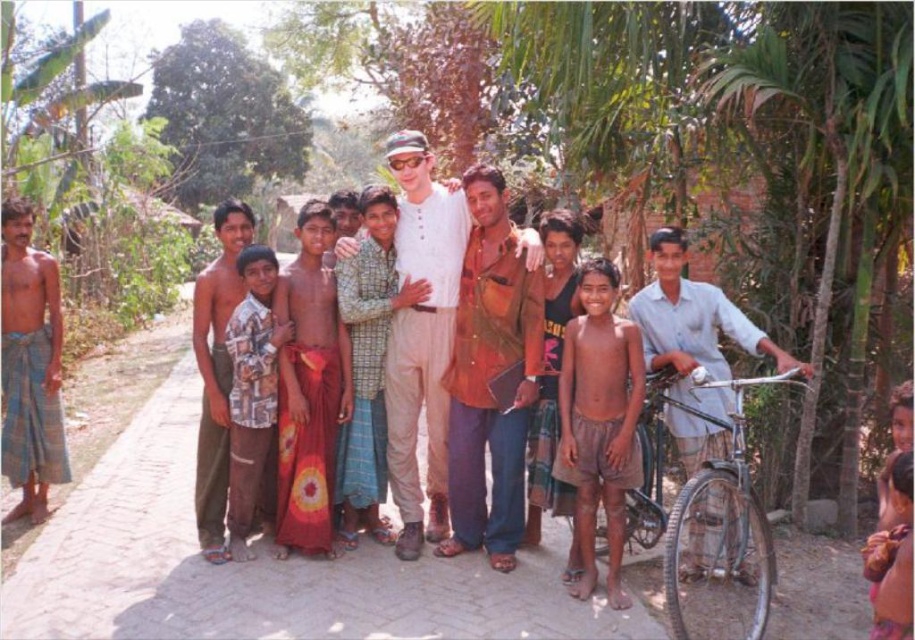
Between brown leather jacket at center and silver metallic bicycle at right, which one appears on the right side from the viewer's perspective?

Positioned to the right is silver metallic bicycle at right.

Does brown leather jacket at center have a lesser width compared to silver metallic bicycle at right?

Correct, brown leather jacket at center's width is less than silver metallic bicycle at right's.

Does point (466, 492) come farther from viewer compared to point (659, 388)?

Yes.

At what (x,y) coordinates should I click in order to perform the action: click on brown leather jacket at center. Please return your answer as a coordinate pair (x, y). Looking at the image, I should click on (490, 376).

Between brown leather jacket at center and brown cotton shorts at center, which one is positioned higher?

brown leather jacket at center

Can you confirm if brown leather jacket at center is positioned to the right of brown cotton shorts at center?

No, brown leather jacket at center is not to the right of brown cotton shorts at center.

Is point (481, 522) positioned in front of point (585, 531)?

No, (481, 522) is behind (585, 531).

Identify the location of brown leather jacket at center. The height and width of the screenshot is (640, 915). [x=490, y=376].

Between brown leather jacket at center and matte white shirt at center, which one is positioned higher?

Positioned higher is brown leather jacket at center.

What do you see at coordinates (490, 376) in the screenshot? I see `brown leather jacket at center` at bounding box center [490, 376].

I want to click on brown leather jacket at center, so click(x=490, y=376).